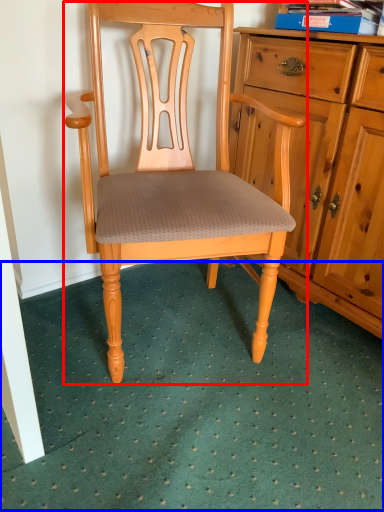
Question: Which point is closer to the camera, chair (highlighted by a red box) or doormat (highlighted by a blue box)?

Choices:
 (A) chair
 (B) doormat

Answer: (B)